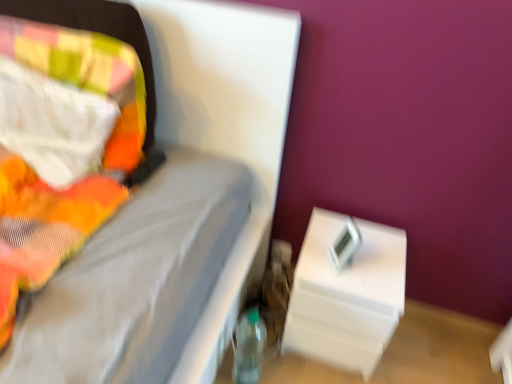
Question: Can you confirm if white plastic nightstand at lower right is positioned to the left of transparent plastic bottle at lower center?

Choices:
 (A) no
 (B) yes

Answer: (A)

Question: Is white plastic nightstand at lower right further to camera compared to transparent plastic bottle at lower center?

Choices:
 (A) no
 (B) yes

Answer: (B)

Question: Would you say transparent plastic bottle at lower center is part of white plastic nightstand at lower right's contents?

Choices:
 (A) yes
 (B) no

Answer: (B)

Question: Is the depth of white plastic nightstand at lower right less than that of transparent plastic bottle at lower center?

Choices:
 (A) yes
 (B) no

Answer: (B)

Question: Is white plastic nightstand at lower right looking in the opposite direction of transparent plastic bottle at lower center?

Choices:
 (A) yes
 (B) no

Answer: (B)

Question: Is transparent plastic bottle at lower center inside the boundaries of white plastic nightstand at lower right, or outside?

Choices:
 (A) outside
 (B) inside

Answer: (A)

Question: In the image, is transparent plastic bottle at lower center positioned in front of or behind white plastic nightstand at lower right?

Choices:
 (A) front
 (B) behind

Answer: (A)

Question: Would you say transparent plastic bottle at lower center is to the left or to the right of white plastic nightstand at lower right in the picture?

Choices:
 (A) left
 (B) right

Answer: (A)

Question: From a real-world perspective, is transparent plastic bottle at lower center above or below white plastic nightstand at lower right?

Choices:
 (A) above
 (B) below

Answer: (B)

Question: From the image's perspective, is fluffy multicolored pillow at left positioned above or below white plastic nightstand at lower right?

Choices:
 (A) above
 (B) below

Answer: (A)

Question: In terms of height, does fluffy multicolored pillow at left look taller or shorter compared to white plastic nightstand at lower right?

Choices:
 (A) short
 (B) tall

Answer: (A)

Question: Considering the positions of fluffy multicolored pillow at left and white plastic nightstand at lower right in the image, is fluffy multicolored pillow at left wider or thinner than white plastic nightstand at lower right?

Choices:
 (A) thin
 (B) wide

Answer: (A)

Question: Is fluffy multicolored pillow at left bigger or smaller than white plastic nightstand at lower right?

Choices:
 (A) big
 (B) small

Answer: (B)

Question: Is white plastic nightstand at lower right inside or outside of fluffy multicolored pillow at left?

Choices:
 (A) inside
 (B) outside

Answer: (B)

Question: Visually, is white plastic nightstand at lower right positioned to the left or to the right of fluffy multicolored pillow at left?

Choices:
 (A) right
 (B) left

Answer: (A)